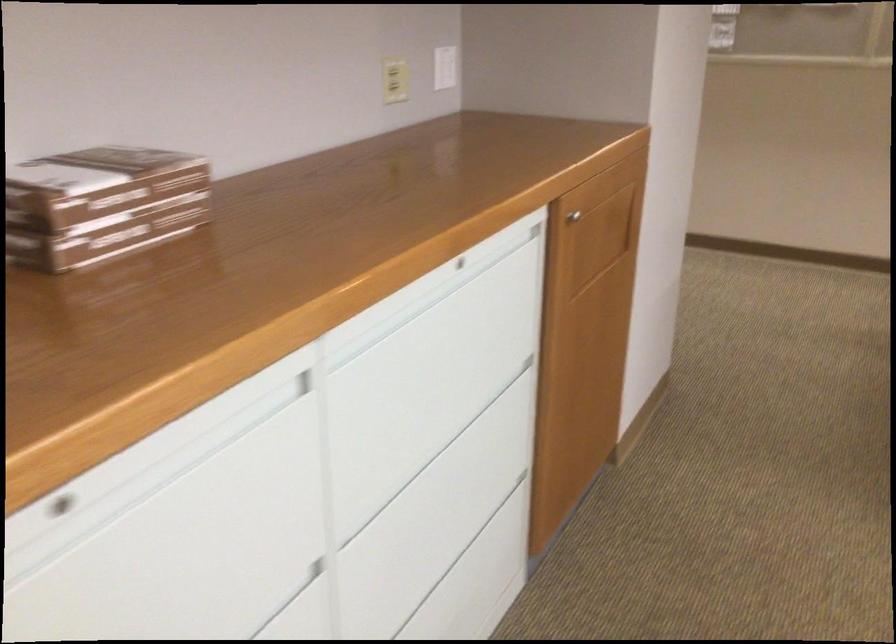
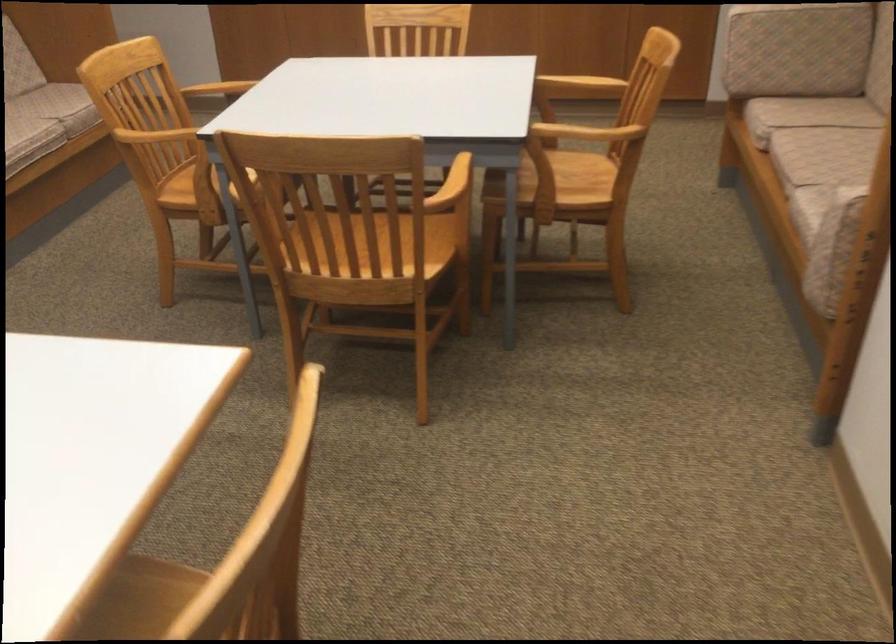
From the picture: The images are taken continuously from a first-person perspective. In which direction is your viewpoint rotating?

The camera's rotation is toward right-down.